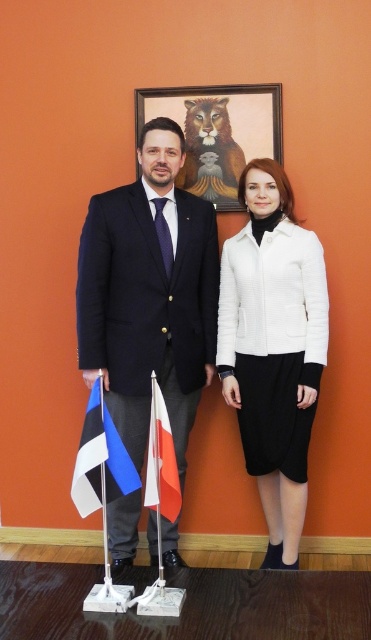
How far apart are blue and white fabric flag at lower left and white fabric flag at center?

The distance of blue and white fabric flag at lower left from white fabric flag at center is 13.32 centimeters.

Does blue and white fabric flag at lower left have a smaller size compared to white fabric flag at center?

Actually, blue and white fabric flag at lower left might be larger than white fabric flag at center.

Is point (115, 483) in front of point (159, 404)?

Yes, point (115, 483) is closer to viewer.

Where is `blue and white fabric flag at lower left`? The image size is (371, 640). blue and white fabric flag at lower left is located at coordinates (100, 460).

Between white textured jacket at center and wooden frame at upper center, which one has more height?

Standing taller between the two is white textured jacket at center.

Which is below, white textured jacket at center or wooden frame at upper center?

white textured jacket at center is below.

Is point (289, 502) positioned in front of point (248, 99)?

Yes, point (289, 502) is closer to viewer.

I want to click on white textured jacket at center, so click(273, 348).

In the scene shown: Who is positioned more to the left, white textured jacket at center or blue and white fabric flag at lower left?

Positioned to the left is blue and white fabric flag at lower left.

Is white textured jacket at center positioned at the back of blue and white fabric flag at lower left?

Yes, white textured jacket at center is behind blue and white fabric flag at lower left.

Which is in front, point (313, 404) or point (103, 410)?

Point (103, 410)

I want to click on white textured jacket at center, so click(273, 348).